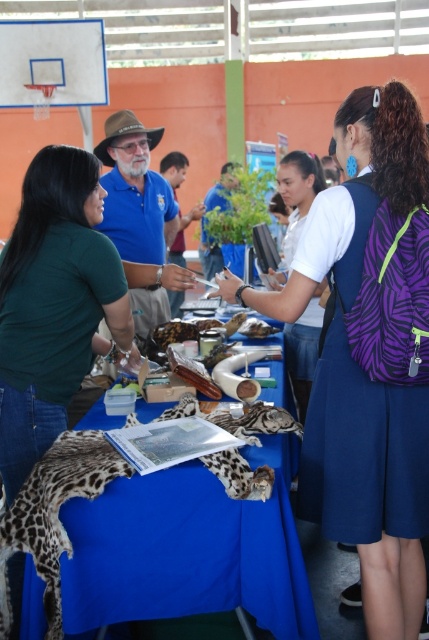
Does matte blue shirt at center have a greater height compared to white matte shirt at center?

Incorrect, matte blue shirt at center's height is not larger of white matte shirt at center's.

Between matte blue shirt at center and white matte shirt at center, which one appears on the left side from the viewer's perspective?

matte blue shirt at center is more to the left.

This screenshot has width=429, height=640. What do you see at coordinates (139, 218) in the screenshot?
I see `matte blue shirt at center` at bounding box center [139, 218].

Find the location of a particular element. This screenshot has width=429, height=640. matte blue shirt at center is located at coordinates (139, 218).

Describe the element at coordinates (368, 352) in the screenshot. I see `purple zebra-pattern backpack at upper right` at that location.

Who is more distant from viewer, (375, 189) or (45, 509)?

The point (375, 189) is more distant.

Describe the element at coordinates (368, 352) in the screenshot. This screenshot has width=429, height=640. I see `purple zebra-pattern backpack at upper right` at that location.

At what (x,y) coordinates should I click in order to perform the action: click on purple zebra-pattern backpack at upper right. Please return your answer as a coordinate pair (x, y). This screenshot has width=429, height=640. Looking at the image, I should click on (368, 352).

Does purple zebra-pattern backpack at upper right lie in front of white matte shirt at center?

Yes.

Describe the element at coordinates (368, 352) in the screenshot. The width and height of the screenshot is (429, 640). I see `purple zebra-pattern backpack at upper right` at that location.

Find the location of a particular element. purple zebra-pattern backpack at upper right is located at coordinates 368,352.